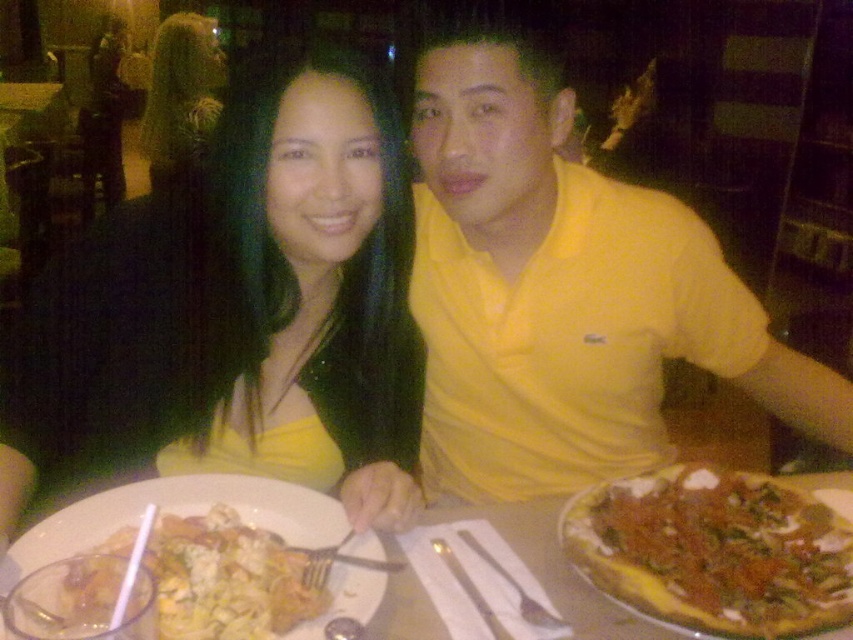
You are a waiter in a restaurant and need to place a dessert plate between the yellow matte dress at center and the golden crispy pizza at center. Which object should you move to make space?

The yellow matte dress at center is wider than the golden crispy pizza at center, so you should move the yellow matte dress at center to create enough space for the dessert plate between them.

You are a photographer standing in front of the table. You want to take a closeup of the yellow matte dress at center and the shiny black hair at center. Which object should you focus on first to ensure it is in sharp focus?

The yellow matte dress at center is closer to the viewer than the shiny black hair at center, so you should focus on the yellow matte dress at center first to ensure it is in sharp focus.

You are a photographer trying to capture a closeup of the yellow matte dress at center and the shiny black hair at center. Since the camera can only focus on one subject at a time, which one should you focus on first to ensure the other is still in the frame?

The yellow matte dress at center is located below shiny black hair at center, so you should focus on the shiny black hair at center first as it is higher up, ensuring the dress remains within the frame below.